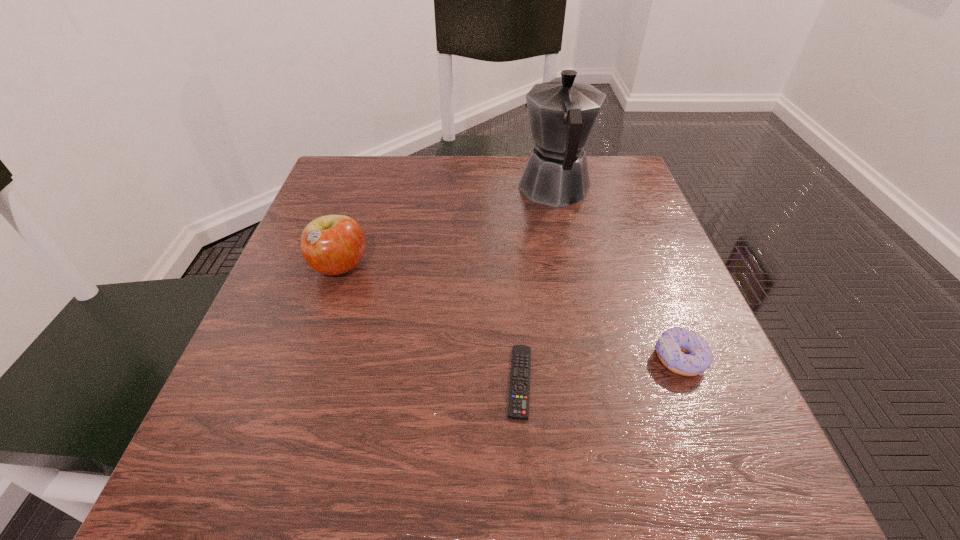
At what (x,y) coordinates should I click in order to perform the action: click on vacant space situated 0.310m on the left of the shortest object. Please return your answer as a coordinate pair (x, y). The height and width of the screenshot is (540, 960). Looking at the image, I should click on (302, 381).

Find the location of a particular element. This screenshot has width=960, height=540. object positioned at the far edge is located at coordinates (562, 113).

The image size is (960, 540). What are the coordinates of `object situated at the left edge` in the screenshot? It's located at (332, 244).

At what (x,y) coordinates should I click in order to perform the action: click on coffeepot that is at the right edge. Please return your answer as a coordinate pair (x, y). This screenshot has height=540, width=960. Looking at the image, I should click on (562, 113).

Identify the location of doughnut that is at the right edge. The image size is (960, 540). (670, 347).

Image resolution: width=960 pixels, height=540 pixels. In order to click on object that is at the far right corner in this screenshot , I will do `click(562, 113)`.

This screenshot has width=960, height=540. I want to click on vacant area at the far edge of the desktop, so click(x=500, y=190).

In the image, there is a desktop. In order to click on free space at the near edge in this screenshot , I will do `click(461, 492)`.

Where is `vacant space at the left edge`? vacant space at the left edge is located at coordinates (324, 369).

Image resolution: width=960 pixels, height=540 pixels. In the image, there is a desktop. What are the coordinates of `vacant space at the right edge` in the screenshot? It's located at (634, 356).